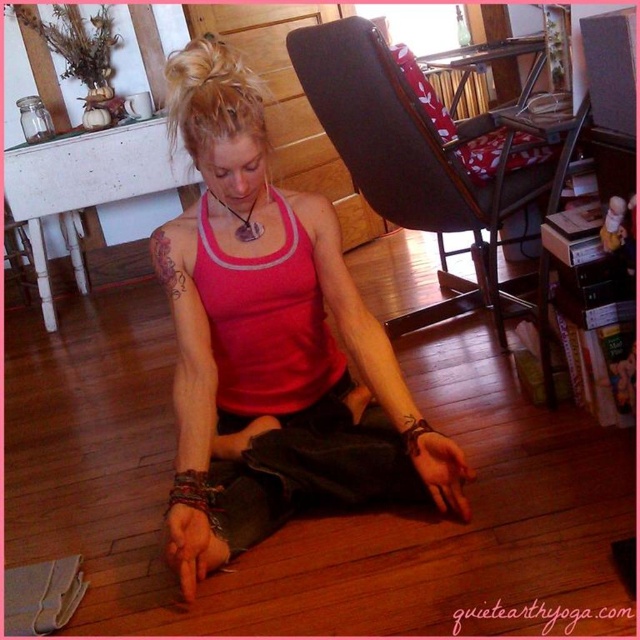
Can you confirm if dark brown leather chair at center is taller than brown ink tattoo at upper left?

Yes.

Does point (406, 214) come in front of point (164, 227)?

No, it is behind (164, 227).

Who is more distant from viewer, (368,81) or (182,241)?

The point (368,81) is behind.

The width and height of the screenshot is (640, 640). I want to click on dark brown leather chair at center, so click(419, 160).

Which is in front, point (196, 86) or point (168, 260)?

Point (196, 86) is more forward.

Can you confirm if blondehair at center is positioned to the right of brown ink tattoo at upper left?

Indeed, blondehair at center is positioned on the right side of brown ink tattoo at upper left.

Is point (237, 64) farther from camera compared to point (180, 246)?

No, (237, 64) is closer to viewer.

Identify the location of blondehair at center. The width and height of the screenshot is (640, 640). (211, 97).

Between pink fabric tank top at center and blondehair at center, which one appears on the left side from the viewer's perspective?

Positioned to the left is blondehair at center.

Which is behind, point (241, 68) or point (195, 161)?

The point (195, 161) is behind.

Locate an element on the screen. This screenshot has width=640, height=640. pink fabric tank top at center is located at coordinates (275, 346).